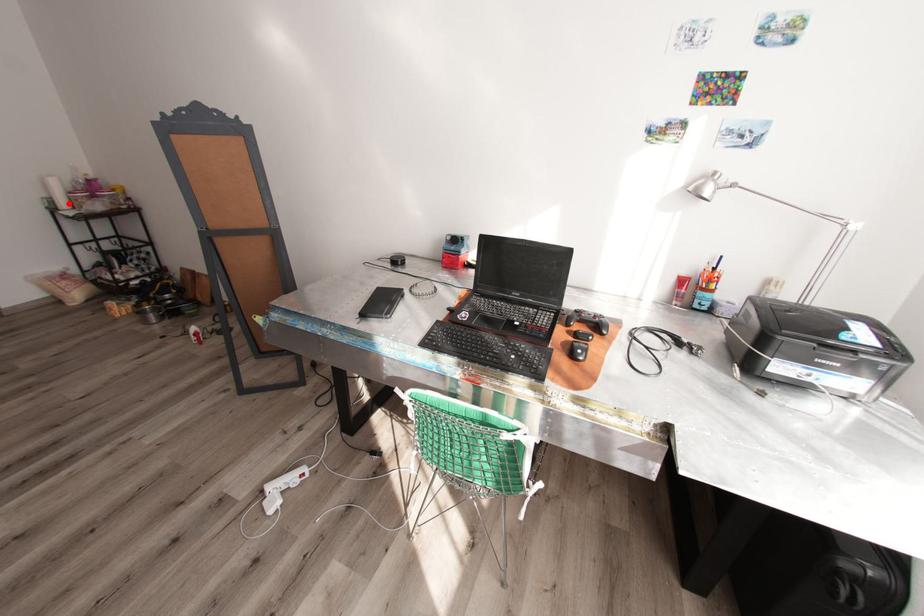
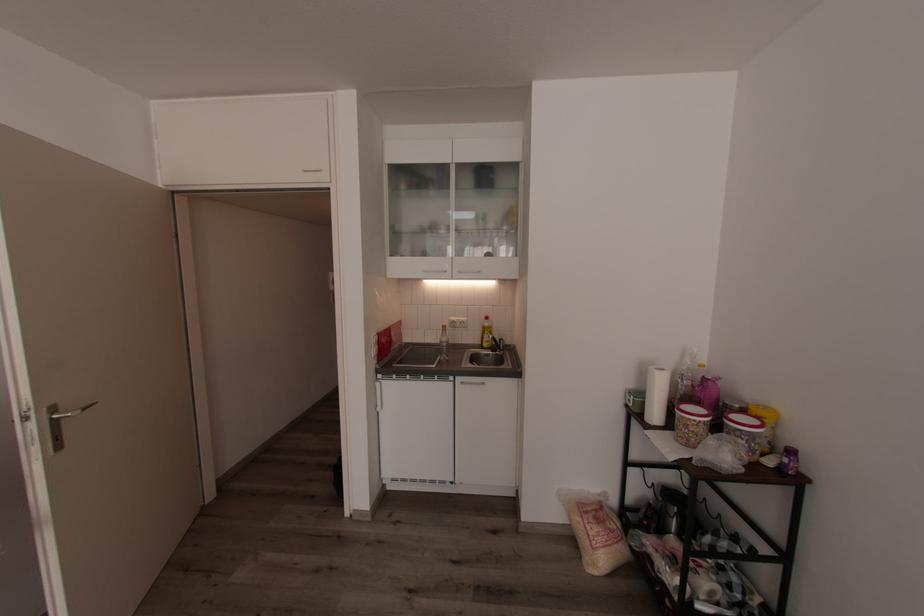
Locate, in the second image, the point that corresponds to the highlighted location in the first image.

(660, 415)